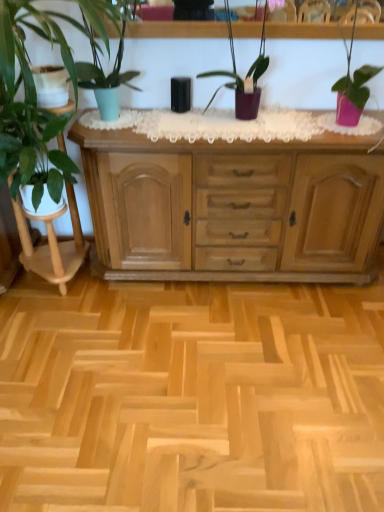
Locate an element on the screen. Image resolution: width=384 pixels, height=512 pixels. vacant area on top of natural wood cabinet at center (from a real-world perspective) is located at coordinates (247, 118).